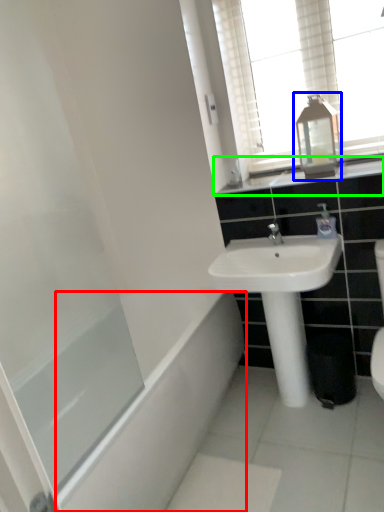
Question: Which is farther away from bath (highlighted by a red box)? medicine cabinet (highlighted by a blue box) or bathroom cabinet (highlighted by a green box)?

Choices:
 (A) medicine cabinet
 (B) bathroom cabinet

Answer: (A)